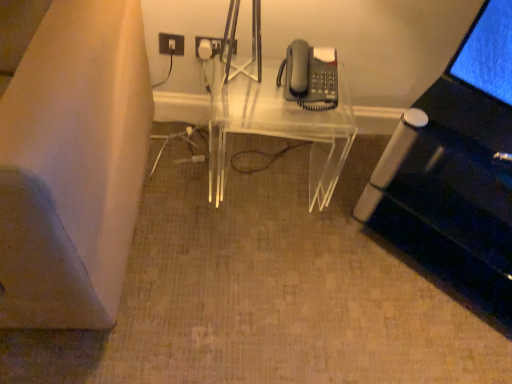
The width and height of the screenshot is (512, 384). What are the coordinates of `free space in front of transparent acrylic table at center` in the screenshot? It's located at (266, 256).